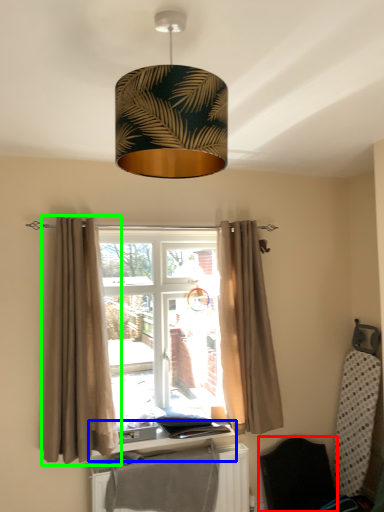
Question: Estimate the real-world distances between objects in this image. Which object is closer to folding chair (highlighted by a red box), window sill (highlighted by a blue box) or curtain (highlighted by a green box)?

Choices:
 (A) window sill
 (B) curtain

Answer: (A)